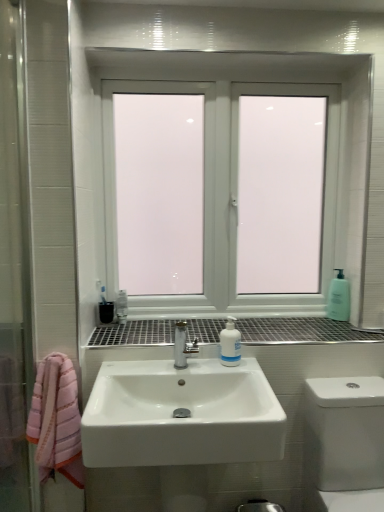
This screenshot has height=512, width=384. Describe the element at coordinates (339, 298) in the screenshot. I see `translucent plastic soap dispenser at right` at that location.

What do you see at coordinates (230, 344) in the screenshot? I see `white plastic bottle at center` at bounding box center [230, 344].

Identify the location of white glossy toilet at lower right. (344, 444).

What is the approximate width of white glossy sink at center?

It is 17.91 inches.

I want to click on translucent plastic soap dispenser at right, so click(x=339, y=298).

Is metallic grid at center not within white plastic bottle at center?

Yes, metallic grid at center is outside of white plastic bottle at center.

Does metallic grid at center have a lesser height compared to white plastic bottle at center?

Indeed, metallic grid at center has a lesser height compared to white plastic bottle at center.

Considering the positions of point (322, 325) and point (233, 351), is point (322, 325) closer or farther from the camera than point (233, 351)?

Point (322, 325) is farther from the camera than point (233, 351).

How much distance is there between metallic grid at center and white plastic bottle at center?

The distance of metallic grid at center from white plastic bottle at center is 9.13 inches.

Is white glossy sink at center at the right side of white plastic bottle at center?

In fact, white glossy sink at center is to the left of white plastic bottle at center.

Is there a large distance between white glossy sink at center and white plastic bottle at center?

white glossy sink at center is actually quite close to white plastic bottle at center.

In the scene shown: Can you tell me how much white glossy sink at center and white plastic bottle at center differ in facing direction?

They differ by 0.835 degrees in their facing directions.

Which is nearer, (212, 426) or (238, 362)?

Point (212, 426) is positioned closer to the camera compared to point (238, 362).

Looking at this image, is there a large distance between white plastic bottle at center and translucent plastic soap dispenser at right?

That's not correct — white plastic bottle at center is a little close to translucent plastic soap dispenser at right.

From the image's perspective, between white plastic bottle at center and translucent plastic soap dispenser at right, which one is located above?

translucent plastic soap dispenser at right, from the image's perspective.

Is white plastic bottle at center turned away from translucent plastic soap dispenser at right?

white plastic bottle at center does not have its back to translucent plastic soap dispenser at right.

Is white plastic bottle at center taller or shorter than translucent plastic soap dispenser at right?

Considering their sizes, white plastic bottle at center has less height than translucent plastic soap dispenser at right.

Identify the location of mouthwash below the white frosted glass window at center (from the image's perspective). The image size is (384, 512). (230, 344).

Considering the relative positions of white plastic bottle at center and white frosted glass window at center in the image provided, is white plastic bottle at center to the right of white frosted glass window at center from the viewer's perspective?

Yes.

Is white frosted glass window at center at the back of white plastic bottle at center?

That's right, white plastic bottle at center is facing away from white frosted glass window at center.

Is white frosted glass window at center taller than translucent plastic soap dispenser at right?

Yes, white frosted glass window at center is taller than translucent plastic soap dispenser at right.

Who is bigger, white frosted glass window at center or translucent plastic soap dispenser at right?

Bigger between the two is white frosted glass window at center.

In order to click on soap dispenser behind the white frosted glass window at center in this screenshot , I will do `click(339, 298)`.

Is white frosted glass window at center thinner than translucent plastic soap dispenser at right?

No.

Does white glossy toilet at lower right lie in front of white plastic bottle at center?

Yes.

Between point (358, 462) and point (239, 347), which one is positioned in front?

The point (358, 462) is more forward.

What are the coordinates of `bath on the right of white plastic bottle at center` in the screenshot? It's located at (344, 444).

From the image's perspective, which is below, white glossy toilet at lower right or white plastic bottle at center?

white glossy toilet at lower right, from the image's perspective.

Between white frosted glass window at center and white plastic bottle at center, which one has larger size?

white frosted glass window at center is bigger.

Which object is wider, white frosted glass window at center or white plastic bottle at center?

Wider between the two is white frosted glass window at center.

At what (x,y) coordinates should I click in order to perform the action: click on window lying on the left of white plastic bottle at center. Please return your answer as a coordinate pair (x, y). Looking at the image, I should click on (222, 186).

This screenshot has width=384, height=512. In order to click on window sill on the right side of white plastic bottle at center in this screenshot , I will do `click(301, 331)`.

In the image, there is a white plastic bottle at center. Where is `sink below it (from a real-world perspective)`? This screenshot has height=512, width=384. sink below it (from a real-world perspective) is located at coordinates (180, 415).

Based on their spatial positions, is metallic grid at center or translucent plastic soap dispenser at right further from white plastic bottle at center?

translucent plastic soap dispenser at right is positioned further to the anchor white plastic bottle at center.

From the image, which object appears to be nearer to translucent plastic soap dispenser at right, white frosted glass window at center or white glossy toilet at lower right?

Among the two, white frosted glass window at center is located nearer to translucent plastic soap dispenser at right.

Based on their spatial positions, is metallic grid at center or white frosted glass window at center closer to white plastic bottle at center?

metallic grid at center is positioned closer to the anchor white plastic bottle at center.

From the picture: Estimate the real-world distances between objects in this image. Which object is closer to white frosted glass window at center, white plastic bottle at center or white glossy sink at center?

white plastic bottle at center is positioned closer to the anchor white frosted glass window at center.

Based on their spatial positions, is white glossy sink at center or metallic grid at center closer to white plastic bottle at center?

The object closer to white plastic bottle at center is metallic grid at center.

Estimate the real-world distances between objects in this image. Which object is closer to white glossy toilet at lower right, white glossy sink at center or translucent plastic soap dispenser at right?

white glossy sink at center is closer to white glossy toilet at lower right.

Based on their spatial positions, is white glossy toilet at lower right or white glossy sink at center further from translucent plastic soap dispenser at right?

Among the two, white glossy sink at center is located further to translucent plastic soap dispenser at right.

When comparing their distances from white frosted glass window at center, does white glossy toilet at lower right or white plastic bottle at center seem closer?

white plastic bottle at center is positioned closer to the anchor white frosted glass window at center.

Find the location of a particular element. soap dispenser between white frosted glass window at center and white glossy sink at center in the vertical direction is located at coordinates (339, 298).

Locate an element on the screen. This screenshot has width=384, height=512. sink between white frosted glass window at center and white glossy toilet at lower right vertically is located at coordinates (180, 415).

Identify the location of sink positioned between white glossy toilet at lower right and translucent plastic soap dispenser at right from near to far. (180, 415).

I want to click on mouthwash positioned between white glossy toilet at lower right and translucent plastic soap dispenser at right from near to far, so click(230, 344).